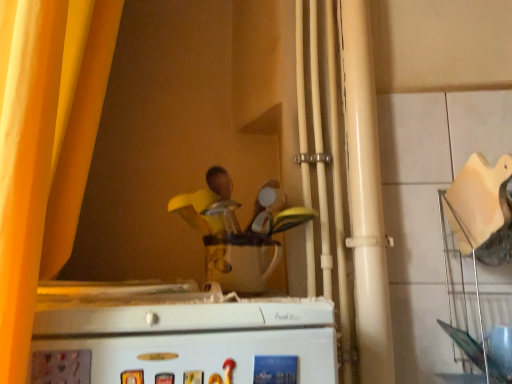
The image size is (512, 384). Identify the location of yellow fabric curtain at left. (45, 146).

In order to face yellow fabric curtain at left, should I rotate leftwards or rightwards?

To face it directly, rotate left by 26.881 degrees.

Measure the distance between yellow fabric curtain at left and camera.

The depth of yellow fabric curtain at left is 22.13 inches.

This screenshot has height=384, width=512. What do you see at coordinates (45, 146) in the screenshot? I see `yellow fabric curtain at left` at bounding box center [45, 146].

You are a GUI agent. You are given a task and a screenshot of the screen. Output one action in this format:
    pyautogui.click(x=<x>, y=<y>)
    Task: Click on the yellow fabric curtain at left
    The height and width of the screenshot is (384, 512).
    Given the screenshot: What is the action you would take?
    pyautogui.click(x=45, y=146)